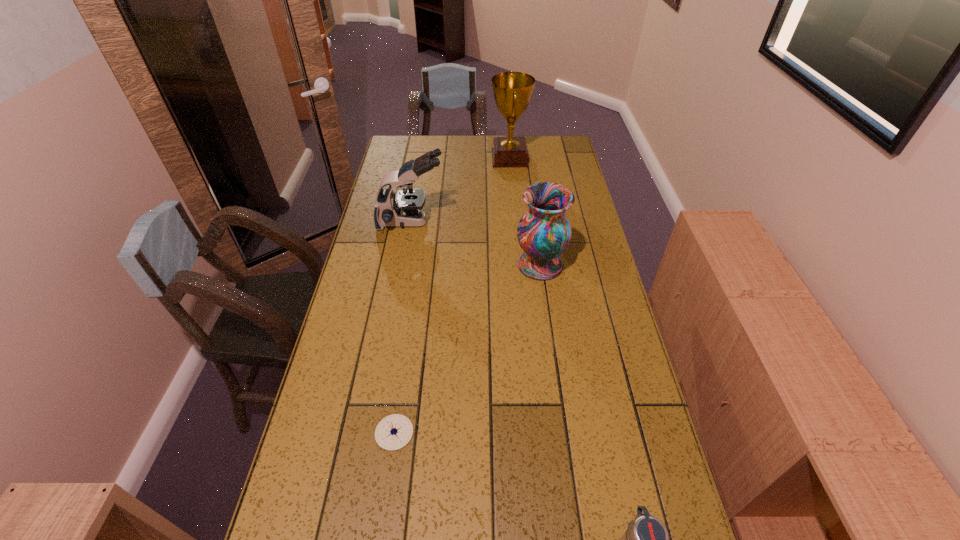
The width and height of the screenshot is (960, 540). I want to click on free space that is in between the compass and the tallest object, so click(452, 295).

You are a GUI agent. You are given a task and a screenshot of the screen. Output one action in this format:
    pyautogui.click(x=<x>, y=<y>)
    Task: Click on the free space between the farthest object and the compass
    Image resolution: width=960 pixels, height=540 pixels.
    Given the screenshot: What is the action you would take?
    pyautogui.click(x=452, y=295)

Locate an element on the screen. free area in between the third farthest object and the tallest object is located at coordinates (525, 212).

At what (x,y) coordinates should I click in order to perform the action: click on free spot between the fourth farthest object and the farthest object. Please return your answer as a coordinate pair (x, y). The width and height of the screenshot is (960, 540). Looking at the image, I should click on (452, 295).

Locate an element on the screen. Image resolution: width=960 pixels, height=540 pixels. vacant area that lies between the compass and the tallest object is located at coordinates (452, 295).

You are a GUI agent. You are given a task and a screenshot of the screen. Output one action in this format:
    pyautogui.click(x=<x>, y=<y>)
    Task: Click on the blank region between the farthest object and the shortest object
    
    Given the screenshot: What is the action you would take?
    pyautogui.click(x=452, y=295)

Locate an element on the screen. the third closest object to the thermos bottle is located at coordinates (404, 208).

Locate which object ranks fourth in proximity to the award. Please provide its 2D coordinates. Your answer should be formatted as a tuple, i.e. [(x, y)], where the tuple contains the x and y coordinates of a point satisfying the conditions above.

[(646, 539)]

Where is `free space in the image that satisfies the following two spatial constraints: 1. on the plaque of the farthest object; 2. on the back side of the third nearest object`? The width and height of the screenshot is (960, 540). free space in the image that satisfies the following two spatial constraints: 1. on the plaque of the farthest object; 2. on the back side of the third nearest object is located at coordinates (519, 265).

Where is `free space that satisfies the following two spatial constraints: 1. through the eyepieces of the third farthest object; 2. on the right side of the microscope`? The image size is (960, 540). free space that satisfies the following two spatial constraints: 1. through the eyepieces of the third farthest object; 2. on the right side of the microscope is located at coordinates (403, 265).